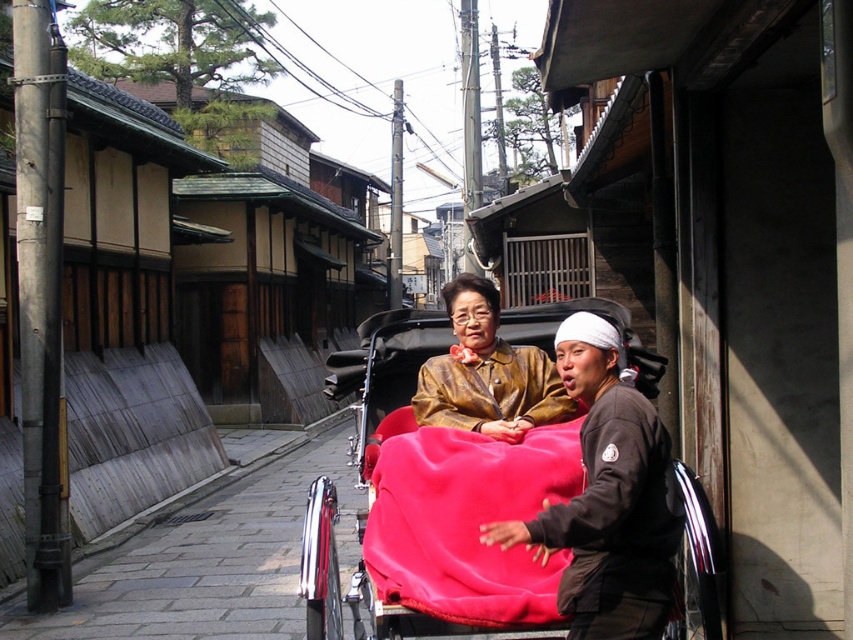
You are standing at the point labeled point (431, 502) in the image. What object are you standing on?

You are standing on the velvet red cart at center.

You are a tourist standing on the traditional Japanese street and want to take a photo of both the velvet red cart at center and the brown leather coach at center. Since you want to capture both in the same frame, which object should you position closer to the camera to ensure both are fully visible?

To capture both the velvet red cart at center and the brown leather coach at center in the same frame, position the velvet red cart at center closer to the camera. Since it is taller than the brown leather coach at center, placing it nearer will help balance their sizes in the photo.